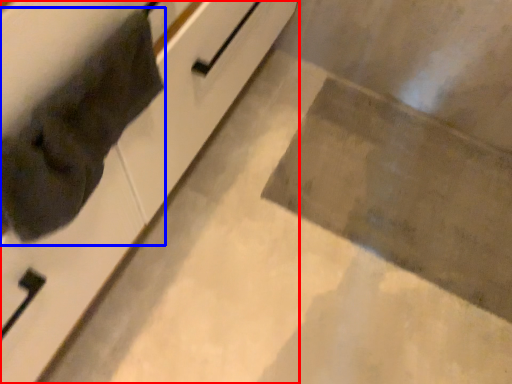
Question: Which object is closer to the camera taking this photo, cabinetry (highlighted by a red box) or cat (highlighted by a blue box)?

Choices:
 (A) cabinetry
 (B) cat

Answer: (A)